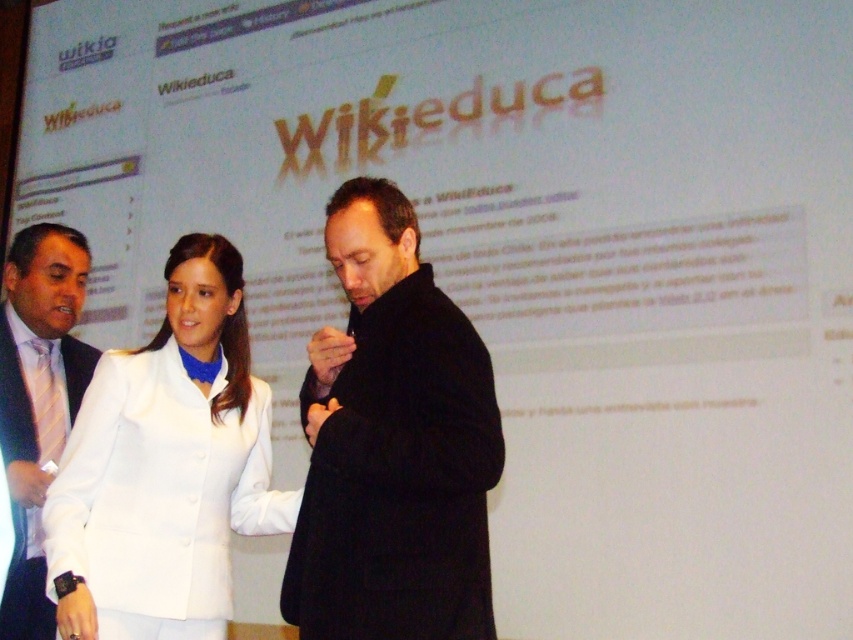
Question: Among these objects, which one is farthest from the camera?

Choices:
 (A) white fabric jacket at center
 (B) black wool coat at center
 (C) white shirt at left

Answer: (C)

Question: Which point appears closest to the camera in this image?

Choices:
 (A) (15, 616)
 (B) (381, 188)
 (C) (84, 432)

Answer: (B)

Question: Where is black wool coat at center located in relation to white shirt at left in the image?

Choices:
 (A) above
 (B) below

Answer: (A)

Question: Estimate the real-world distances between objects in this image. Which object is farther from the white shirt at left?

Choices:
 (A) white fabric jacket at center
 (B) black wool coat at center

Answer: (B)

Question: Is black wool coat at center below white fabric jacket at center?

Choices:
 (A) yes
 (B) no

Answer: (B)

Question: Does black wool coat at center appear under white fabric jacket at center?

Choices:
 (A) yes
 (B) no

Answer: (B)